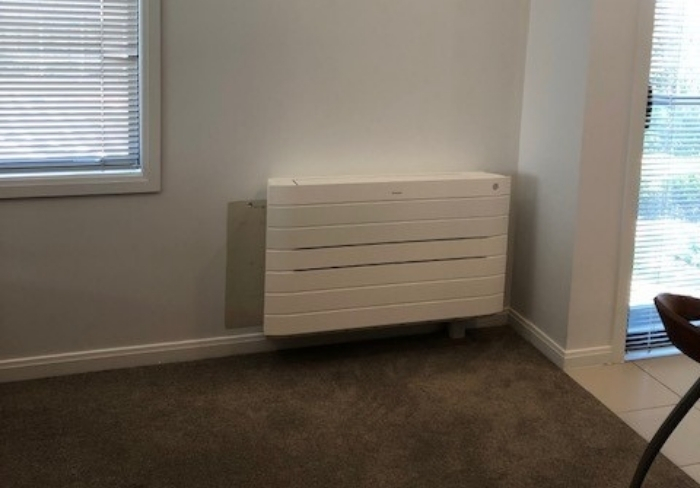
Identify the location of logo on air/heating unit. This screenshot has height=488, width=700. (397, 193).